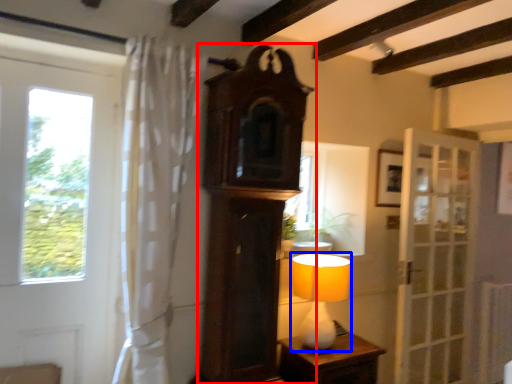
Question: Which object appears farthest to the camera in this image, clock (highlighted by a red box) or table lamp (highlighted by a blue box)?

Choices:
 (A) clock
 (B) table lamp

Answer: (B)